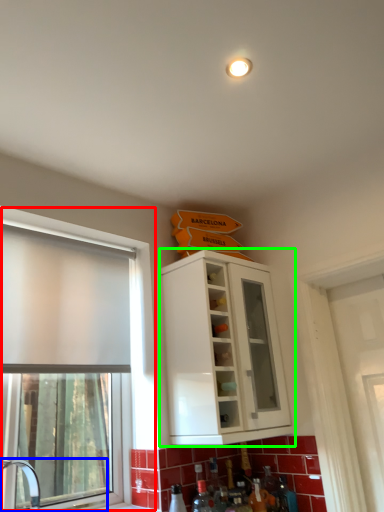
Question: Estimate the real-world distances between objects in this image. Which object is farther from window (highlighted by a red box), sink (highlighted by a blue box) or cabinetry (highlighted by a green box)?

Choices:
 (A) sink
 (B) cabinetry

Answer: (B)